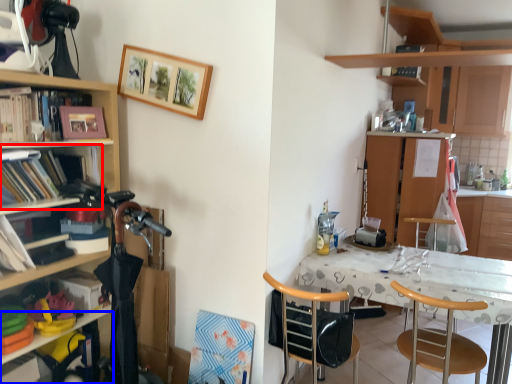
Question: Among these objects, which one is nearest to the camera, shelf (highlighted by a red box) or shelf (highlighted by a blue box)?

Choices:
 (A) shelf
 (B) shelf

Answer: (A)